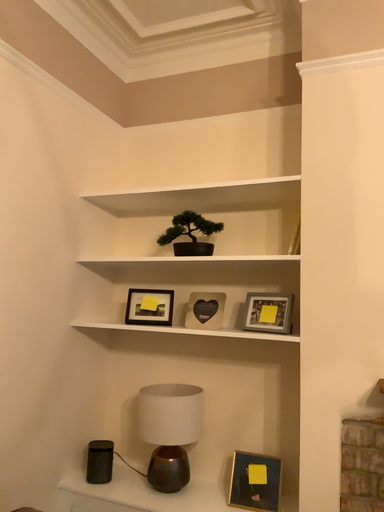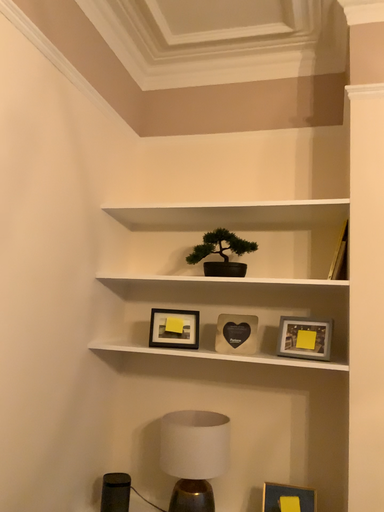
Question: How did the camera likely rotate when shooting the video?

Choices:
 (A) rotated right
 (B) rotated left

Answer: (A)